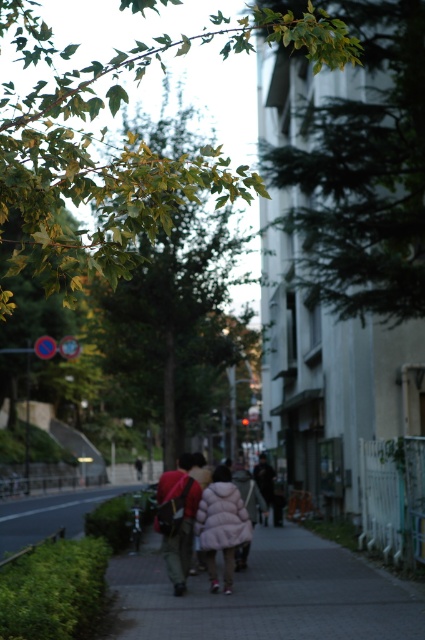
Is the position of green leafy tree at upper left more distant than that of fluffy pink coat at center?

No, green leafy tree at upper left is closer to the viewer.

Looking at this image, can you confirm if green leafy tree at upper left is taller than fluffy pink coat at center?

Yes.

At what (x,y) coordinates should I click in order to perform the action: click on green leafy tree at upper left. Please return your answer as a coordinate pair (x, y). The width and height of the screenshot is (425, 640). Looking at the image, I should click on (172, 321).

Does point (158, 248) come in front of point (187, 506)?

No, it is not.

Can you confirm if green leafy tree at upper left is positioned above khaki canvas backpack at center?

Yes.

At what (x,y) coordinates should I click in order to perform the action: click on green leafy tree at upper left. Please return your answer as a coordinate pair (x, y). Looking at the image, I should click on (x=172, y=321).

The height and width of the screenshot is (640, 425). I want to click on green leafy tree at upper left, so click(x=172, y=321).

Does fluffy pink coat at center have a greater width compared to fluffy pink jacket at center?

Yes.

Who is positioned more to the right, fluffy pink coat at center or fluffy pink jacket at center?

From the viewer's perspective, fluffy pink jacket at center appears more on the right side.

I want to click on fluffy pink coat at center, so click(200, 520).